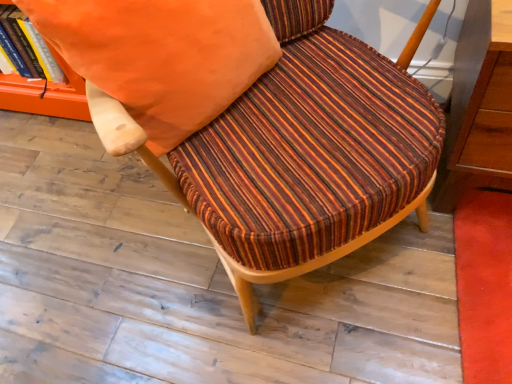
Question: From a real-world perspective, is striped fabric chair at center physically located above or below orange fabric pillow at upper center?

Choices:
 (A) below
 (B) above

Answer: (A)

Question: Is striped fabric chair at center situated inside orange fabric pillow at upper center or outside?

Choices:
 (A) inside
 (B) outside

Answer: (B)

Question: Which object is positioned closest to the orange fabric book at upper left?

Choices:
 (A) orange fabric pillow at upper center
 (B) striped fabric chair at center

Answer: (A)

Question: Which object is positioned farthest from the striped fabric chair at center?

Choices:
 (A) orange fabric pillow at upper center
 (B) orange fabric book at upper left

Answer: (B)